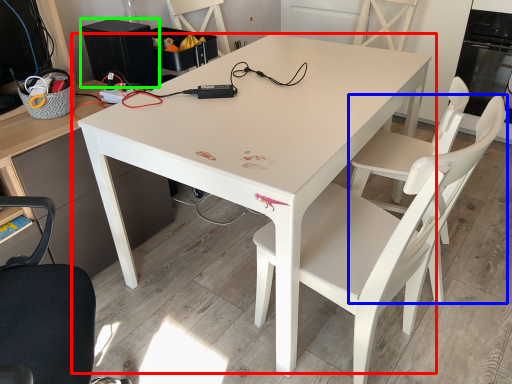
Question: Which object is the closest to the table (highlighted by a red box)? Choose among these: armchair (highlighted by a blue box) or appliance (highlighted by a green box).

Choices:
 (A) armchair
 (B) appliance

Answer: (B)